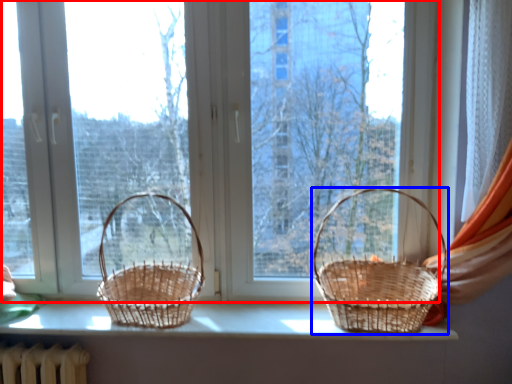
Question: Which of the following is the closest to the observer, window (highlighted by a red box) or picnic basket (highlighted by a blue box)?

Choices:
 (A) window
 (B) picnic basket

Answer: (B)